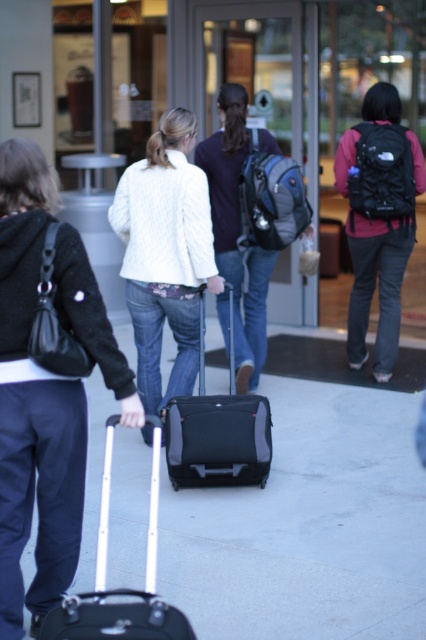
Does white knitted sweater at center have a greater width compared to matte black backpack at center?

Correct, the width of white knitted sweater at center exceeds that of matte black backpack at center.

Identify the location of white knitted sweater at center. (166, 253).

Does white matte sweater at center lie behind white knitted sweater at center?

No, it is in front of white knitted sweater at center.

Is point (6, 218) closer to camera compared to point (129, 257)?

Yes, it is.

The image size is (426, 640). I want to click on white matte sweater at center, so click(34, 404).

Is white knitted sweater at center closer to the viewer compared to matte black suitcase at center?

No, it is behind matte black suitcase at center.

Is the position of white knitted sweater at center more distant than that of matte black suitcase at center?

That is True.

Image resolution: width=426 pixels, height=640 pixels. I want to click on white knitted sweater at center, so pos(166,253).

The height and width of the screenshot is (640, 426). Identify the location of white knitted sweater at center. (166, 253).